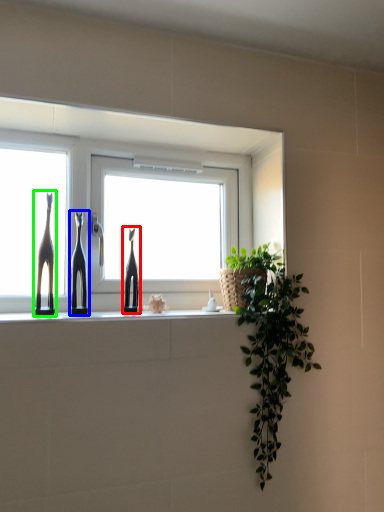
Question: Considering the real-world distances, which object is farthest from sculpture (highlighted by a red box)? sculpture (highlighted by a blue box) or giraffe (highlighted by a green box)?

Choices:
 (A) sculpture
 (B) giraffe

Answer: (B)